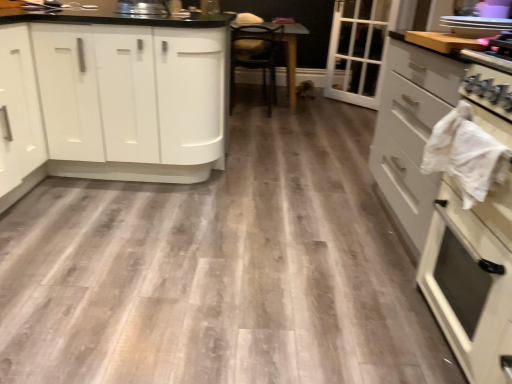
Question: Is white glossy cabinets at left, the first cabinetry from the back, inside or outside of wooden table at center?

Choices:
 (A) inside
 (B) outside

Answer: (B)

Question: Is white glossy cabinets at left, which ranks as the 2th cabinetry in right-to-left order, in front of or behind wooden table at center in the image?

Choices:
 (A) behind
 (B) front

Answer: (B)

Question: Considering the real-world distances, which object is closest to the white glossy plates at upper right?

Choices:
 (A) white glossy oven at right, placed as the 1th cabinetry when sorted from front to back
 (B) white glass door at upper right
 (C) white glossy cabinets at left, the first cabinetry in the top-to-bottom sequence
 (D) wooden table at center

Answer: (A)

Question: Which object is the farthest from the wooden table at center?

Choices:
 (A) white glossy plates at upper right
 (B) white glossy cabinets at left, the second cabinetry ordered from the bottom
 (C) white glossy oven at right, acting as the 2th cabinetry starting from the left
 (D) white glass door at upper right

Answer: (C)